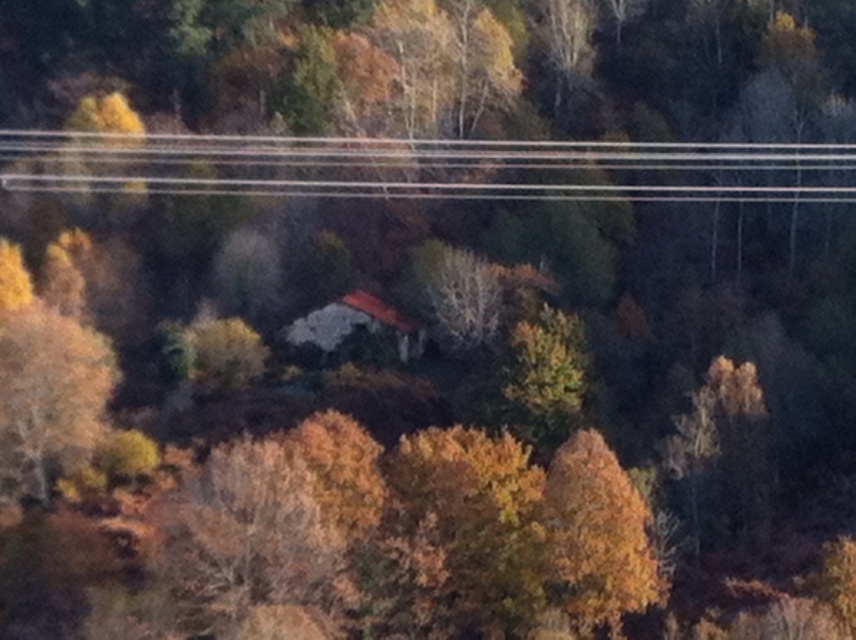
Does clear plastic power lines at upper center appear on the right side of golden textured tree at left?

Indeed, clear plastic power lines at upper center is positioned on the right side of golden textured tree at left.

Consider the image. Who is taller, clear plastic power lines at upper center or golden textured tree at left?

golden textured tree at left is taller.

The height and width of the screenshot is (640, 856). Find the location of `clear plastic power lines at upper center`. clear plastic power lines at upper center is located at coordinates (419, 168).